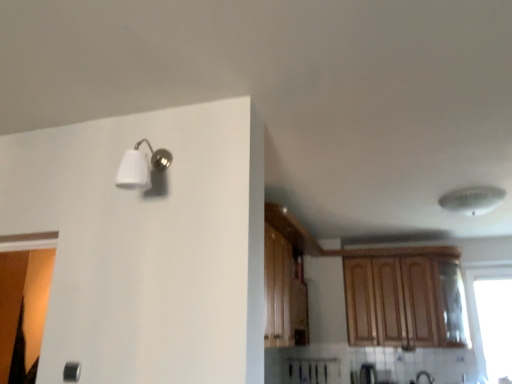
Question: Is white plastic ceiling fan at upper right bigger than white matte light fixture at upper left?

Choices:
 (A) yes
 (B) no

Answer: (A)

Question: Is white plastic ceiling fan at upper right located outside white matte light fixture at upper left?

Choices:
 (A) yes
 (B) no

Answer: (A)

Question: From a real-world perspective, does white plastic ceiling fan at upper right stand above white matte light fixture at upper left?

Choices:
 (A) yes
 (B) no

Answer: (A)

Question: Is white plastic ceiling fan at upper right oriented towards white matte light fixture at upper left?

Choices:
 (A) no
 (B) yes

Answer: (A)

Question: Can you confirm if white plastic ceiling fan at upper right is thinner than white matte light fixture at upper left?

Choices:
 (A) no
 (B) yes

Answer: (A)

Question: Considering the positions of white matte light fixture at upper left and white plastic ceiling fan at upper right in the image, is white matte light fixture at upper left taller or shorter than white plastic ceiling fan at upper right?

Choices:
 (A) tall
 (B) short

Answer: (A)

Question: Considering the positions of white matte light fixture at upper left and white plastic ceiling fan at upper right in the image, is white matte light fixture at upper left wider or thinner than white plastic ceiling fan at upper right?

Choices:
 (A) wide
 (B) thin

Answer: (B)

Question: In the image, is white matte light fixture at upper left positioned in front of or behind white plastic ceiling fan at upper right?

Choices:
 (A) behind
 (B) front

Answer: (B)

Question: Do you think white matte light fixture at upper left is within white plastic ceiling fan at upper right, or outside of it?

Choices:
 (A) inside
 (B) outside

Answer: (B)

Question: Based on their positions, is wooden cabinet at upper right located to the left or right of white plastic ceiling fan at upper right?

Choices:
 (A) right
 (B) left

Answer: (B)

Question: From the image's perspective, is wooden cabinet at upper right positioned above or below white plastic ceiling fan at upper right?

Choices:
 (A) below
 (B) above

Answer: (A)

Question: From a real-world perspective, is wooden cabinet at upper right positioned above or below white plastic ceiling fan at upper right?

Choices:
 (A) above
 (B) below

Answer: (B)

Question: Is wooden cabinet at upper right wider or thinner than white plastic ceiling fan at upper right?

Choices:
 (A) thin
 (B) wide

Answer: (A)

Question: Relative to transparent glass window at right, is wooden cabinet at upper right in front or behind?

Choices:
 (A) front
 (B) behind

Answer: (A)

Question: From their relative heights in the image, would you say wooden cabinet at upper right is taller or shorter than transparent glass window at right?

Choices:
 (A) short
 (B) tall

Answer: (A)